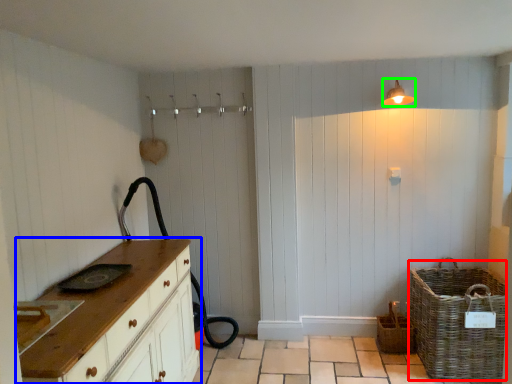
Question: Which is nearer to the basket (highlighted by a red box)? chest of drawers (highlighted by a blue box) or light fixture (highlighted by a green box).

Choices:
 (A) chest of drawers
 (B) light fixture

Answer: (B)